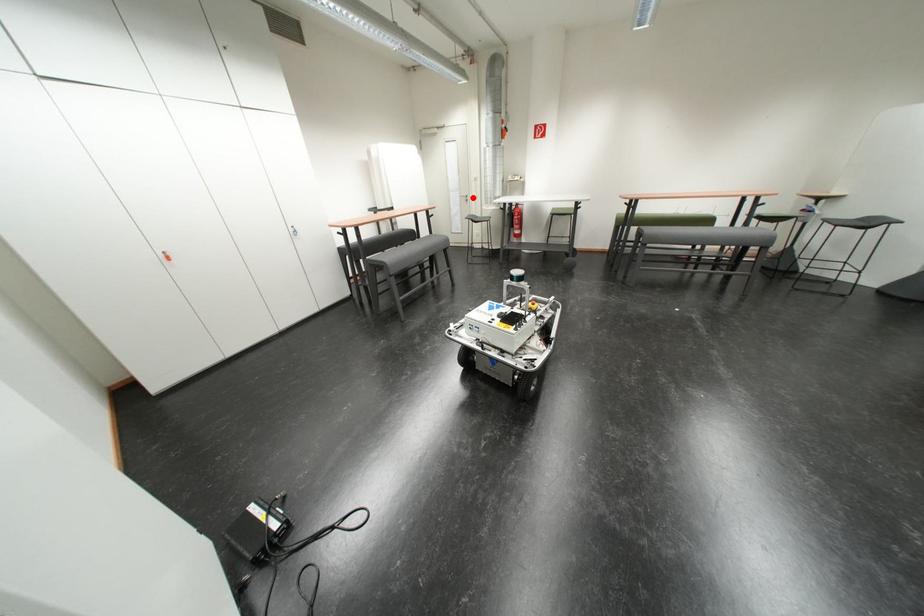
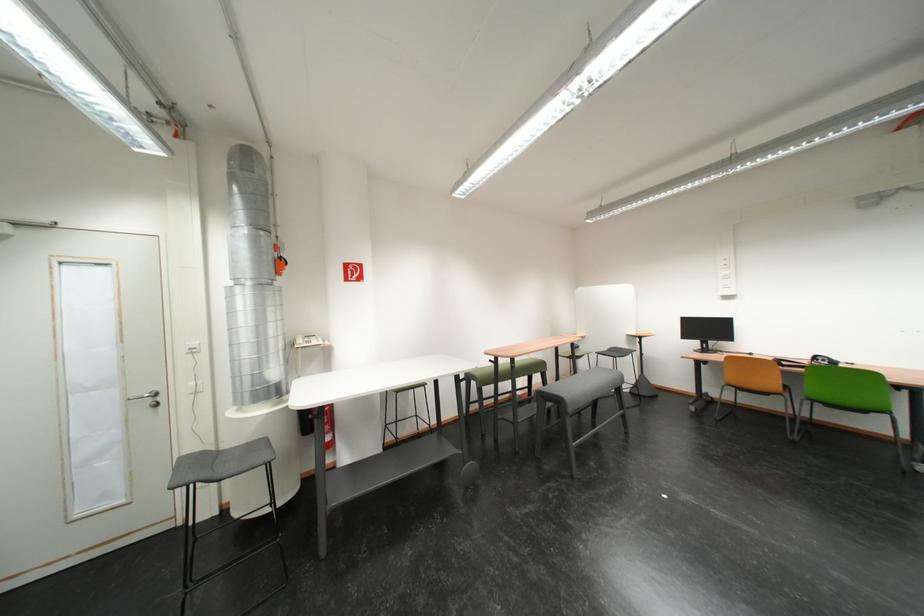
In the second image, find the point that corresponds to the highlighted location in the first image.

(146, 398)